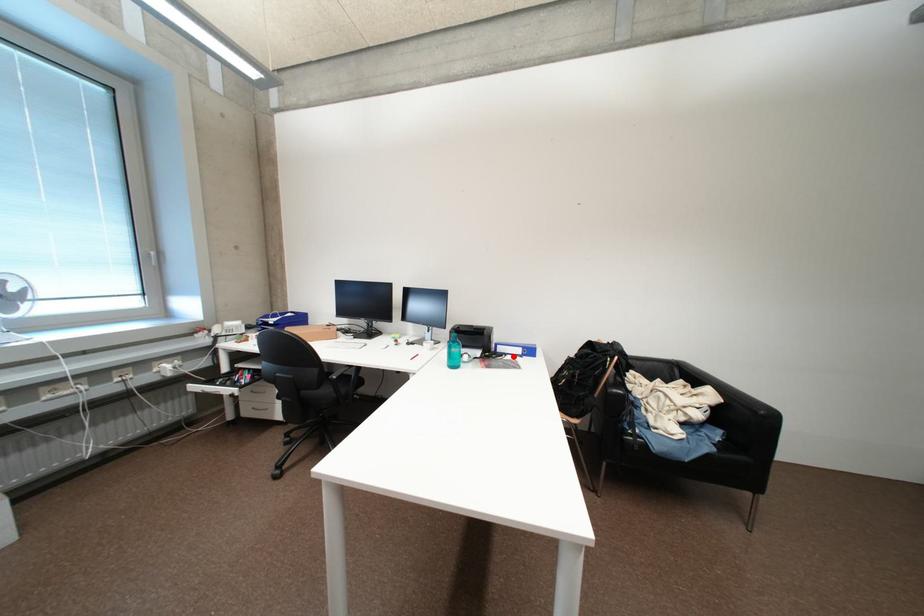
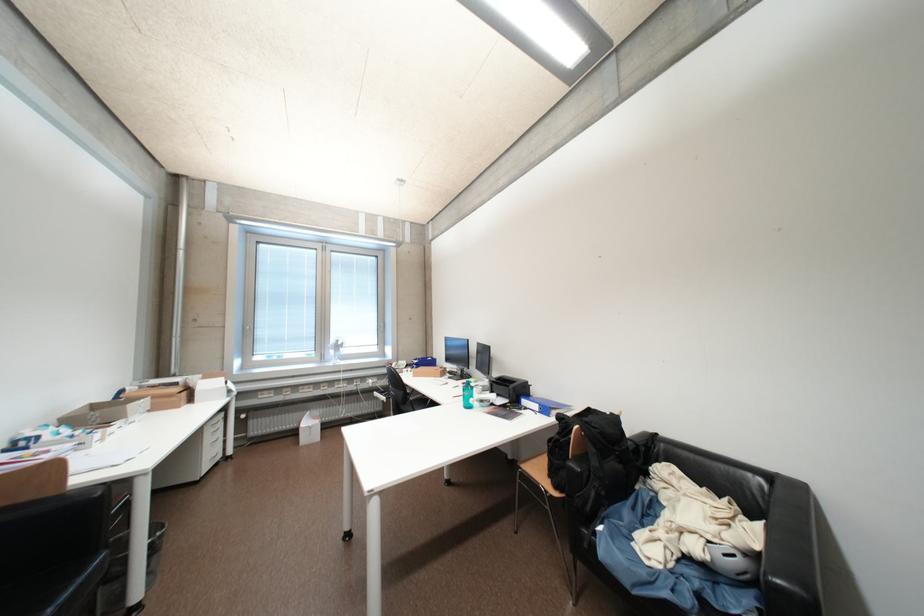
Where in the second image is the point corresponding to the highlighted location from the first image?

(533, 411)